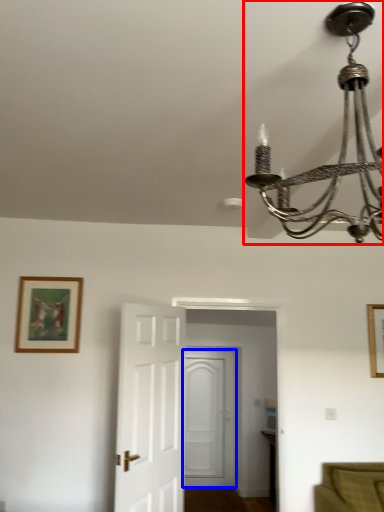
Question: Which object appears closest to the camera in this image, lamp (highlighted by a red box) or door (highlighted by a blue box)?

Choices:
 (A) lamp
 (B) door

Answer: (A)